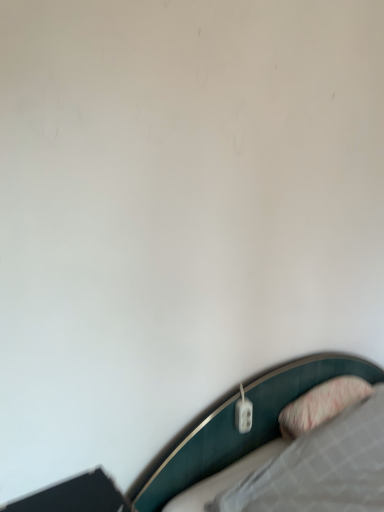
Question: In terms of height, does pink textured pillow at lower right look taller or shorter compared to white plastic electric outlet at lower right?

Choices:
 (A) tall
 (B) short

Answer: (A)

Question: From the image's perspective, is pink textured pillow at lower right located above or below white plastic electric outlet at lower right?

Choices:
 (A) below
 (B) above

Answer: (A)

Question: Visually, is pink textured pillow at lower right positioned to the left or to the right of white plastic electric outlet at lower right?

Choices:
 (A) left
 (B) right

Answer: (B)

Question: From a real-world perspective, relative to pink textured pillow at lower right, is white plastic electric outlet at lower right vertically above or below?

Choices:
 (A) below
 (B) above

Answer: (B)

Question: In terms of size, does white plastic electric outlet at lower right appear bigger or smaller than pink textured pillow at lower right?

Choices:
 (A) big
 (B) small

Answer: (B)

Question: In terms of height, does white plastic electric outlet at lower right look taller or shorter compared to pink textured pillow at lower right?

Choices:
 (A) short
 (B) tall

Answer: (A)

Question: Is point (236, 426) positioned closer to the camera than point (347, 390)?

Choices:
 (A) closer
 (B) farther

Answer: (A)